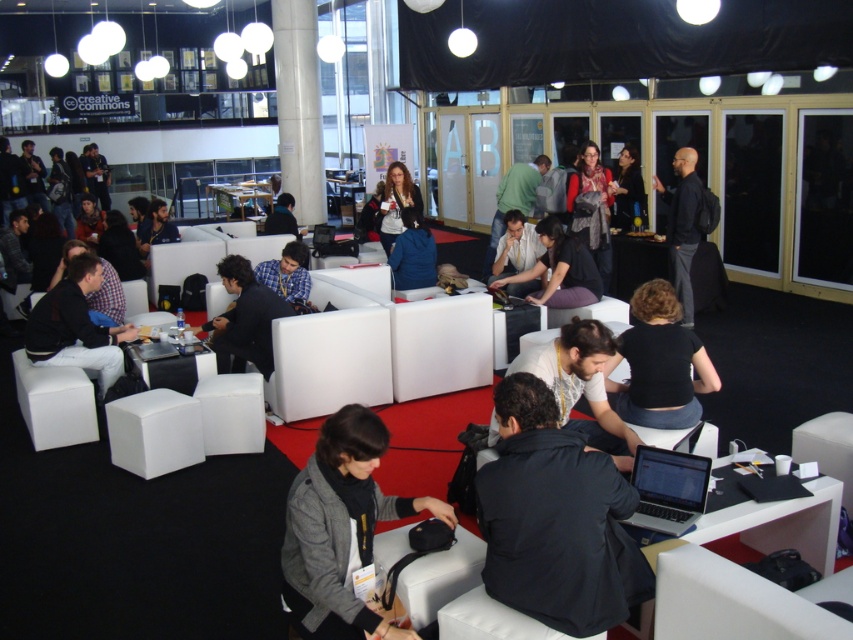
Image resolution: width=853 pixels, height=640 pixels. I want to click on dark blue fabric jacket at lower center, so click(555, 518).

Who is more forward, (x=502, y=438) or (x=416, y=257)?

Point (x=502, y=438) is more forward.

Where is `dark blue fabric jacket at lower center`? This screenshot has width=853, height=640. dark blue fabric jacket at lower center is located at coordinates [x=555, y=518].

Is white shirt at center to the left of blue plaid shirt at center from the viewer's perspective?

No, white shirt at center is not to the left of blue plaid shirt at center.

Between white shirt at center and blue plaid shirt at center, which one appears on the right side from the viewer's perspective?

From the viewer's perspective, white shirt at center appears more on the right side.

Locate an element on the screen. The width and height of the screenshot is (853, 640). white shirt at center is located at coordinates (514, 198).

This screenshot has width=853, height=640. In order to click on white shirt at center in this screenshot , I will do `click(514, 198)`.

Is dark gray fabric jacket at lower left in front of white shirt at center?

Yes, dark gray fabric jacket at lower left is closer to the viewer.

Is point (134, 330) behind point (502, 228)?

No, it is not.

Who is more distant from viewer, (26, 348) or (509, 198)?

The point (509, 198) is behind.

Locate an element on the screen. The height and width of the screenshot is (640, 853). dark gray fabric jacket at lower left is located at coordinates (76, 326).